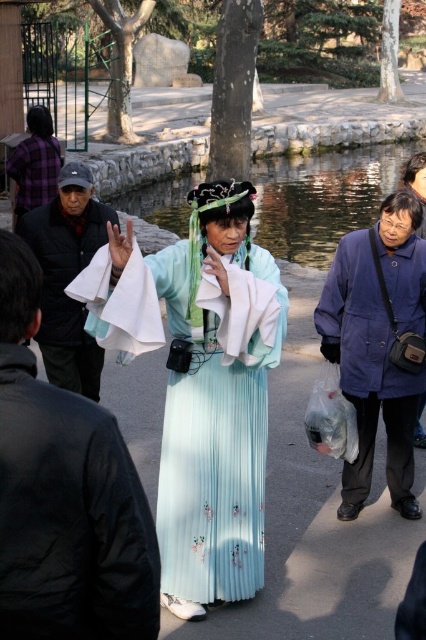
Question: Is dark gray fabric jacket at left above purple plaid shirt at left?

Choices:
 (A) yes
 (B) no

Answer: (B)

Question: Is matte black jacket at left smaller than purple plaid shirt at left?

Choices:
 (A) no
 (B) yes

Answer: (B)

Question: Which of the following is the farthest from the observer?

Choices:
 (A) (247, 211)
 (B) (0, 528)
 (C) (377, 284)
 (D) (342, 205)

Answer: (D)

Question: Among these objects, which one is nearest to the camera?

Choices:
 (A) light blue silk skirt at center
 (B) dark gray fabric jacket at left
 (C) transparent plastic bag at center
 (D) purple plaid shirt at left

Answer: (A)

Question: Which of the following is the farthest from the observer?

Choices:
 (A) blue wool coat at right
 (B) purple plaid shirt at left
 (C) dark gray fabric jacket at left

Answer: (B)

Question: Is transparent plastic bag at center to the left of white cotton towel at center from the viewer's perspective?

Choices:
 (A) no
 (B) yes

Answer: (A)